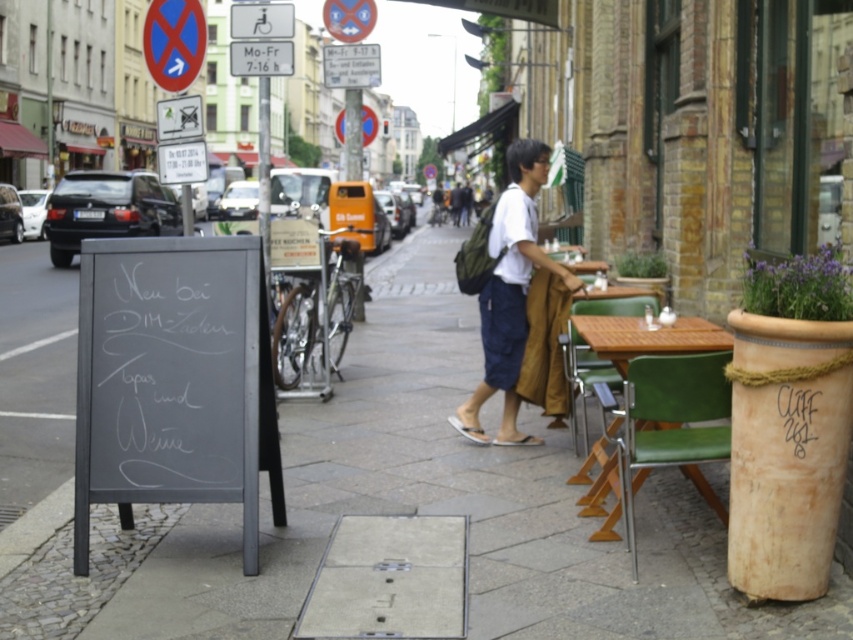
Does point (527, 160) come in front of point (712, 499)?

No, it is behind (712, 499).

Is white cotton shirt at center smaller than wooden table at right?

Yes, white cotton shirt at center is smaller than wooden table at right.

Is point (541, 172) positioned behind point (720, 508)?

Yes, it is behind point (720, 508).

I want to click on white cotton shirt at center, so click(x=509, y=292).

Between black chalkboard at lower left and white cotton shirt at center, which one is positioned higher?

black chalkboard at lower left is higher up.

How distant is black chalkboard at lower left from white cotton shirt at center?

black chalkboard at lower left is 8.81 feet away from white cotton shirt at center.

Is point (131, 342) farther from viewer compared to point (514, 280)?

That is False.

Where is `black chalkboard at lower left`? The image size is (853, 640). black chalkboard at lower left is located at coordinates (173, 381).

Consider the image. Can you confirm if smooth concrete pavement at center is shorter than wooden table at right?

Incorrect, smooth concrete pavement at center's height does not fall short of wooden table at right's.

This screenshot has width=853, height=640. Describe the element at coordinates (408, 512) in the screenshot. I see `smooth concrete pavement at center` at that location.

What are the coordinates of `smooth concrete pavement at center` in the screenshot? It's located at (408, 512).